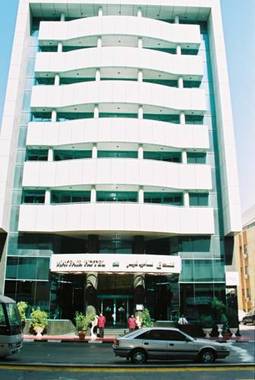
Locate an element on the screen. The image size is (255, 380). support column is located at coordinates (93, 285), (139, 285).